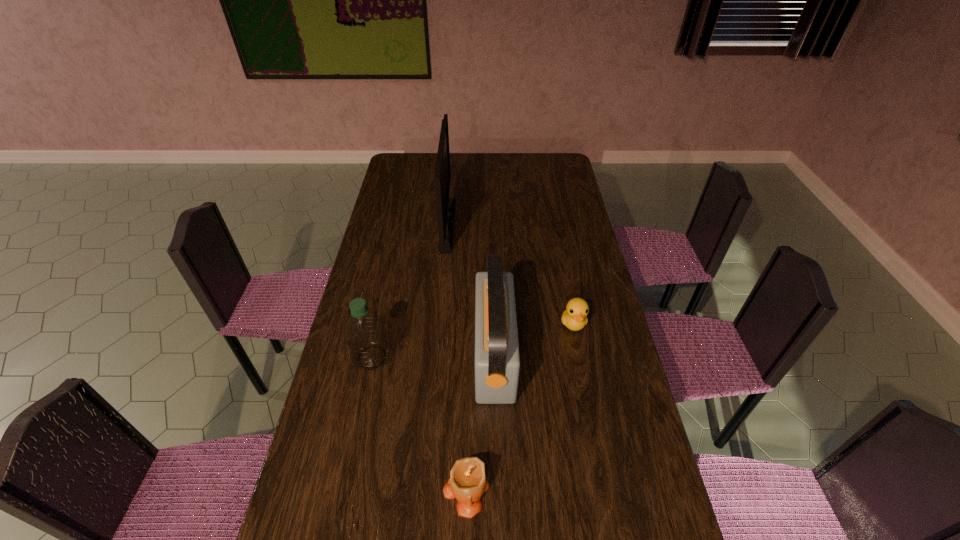
Where is `the farthest object`? The width and height of the screenshot is (960, 540). the farthest object is located at coordinates (445, 206).

The width and height of the screenshot is (960, 540). I want to click on the second object from left to right, so click(445, 206).

Find the location of a particular element. radio receiver is located at coordinates (497, 361).

At what (x,y) coordinates should I click in order to perform the action: click on the leftmost object. Please return your answer as a coordinate pair (x, y). This screenshot has height=540, width=960. Looking at the image, I should click on (364, 330).

Locate an element on the screen. The width and height of the screenshot is (960, 540). the third tallest object is located at coordinates (364, 330).

Find the location of a particular element. This screenshot has height=540, width=960. the nearest object is located at coordinates (467, 482).

This screenshot has height=540, width=960. Identify the location of the rightmost object. (574, 317).

You are a GUI agent. You are given a task and a screenshot of the screen. Output one action in this format:
    pyautogui.click(x=<x>, y=<y>)
    Task: Click on the vacant space located on the front-facing side of the second object from left to right
    The height and width of the screenshot is (540, 960).
    Given the screenshot: What is the action you would take?
    pyautogui.click(x=471, y=224)

Identify the location of free location located 0.340m on the front-facing side of the radio receiver. This screenshot has width=960, height=540. (364, 355).

Where is `vacant position located on the front-facing side of the radio receiver`? The height and width of the screenshot is (540, 960). vacant position located on the front-facing side of the radio receiver is located at coordinates (380, 355).